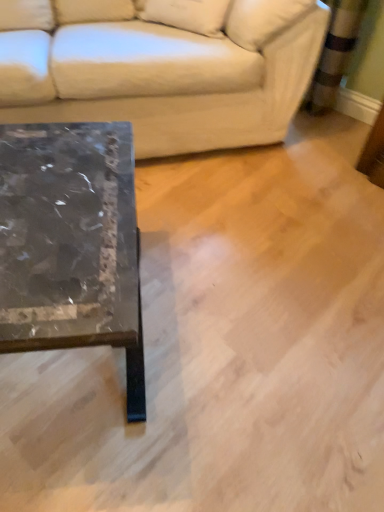
Where is `vacant space to the right of marble/black at left`? This screenshot has height=512, width=384. vacant space to the right of marble/black at left is located at coordinates (234, 329).